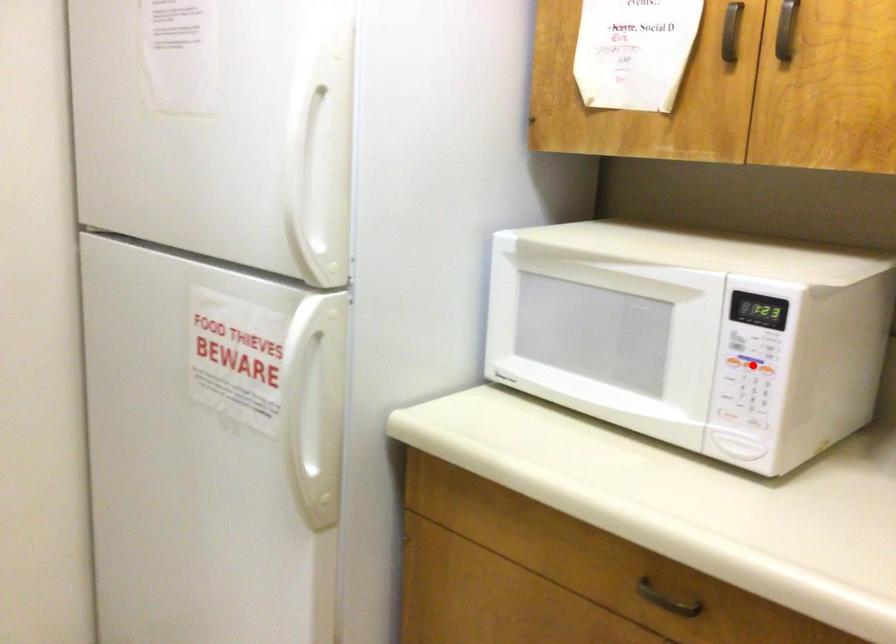
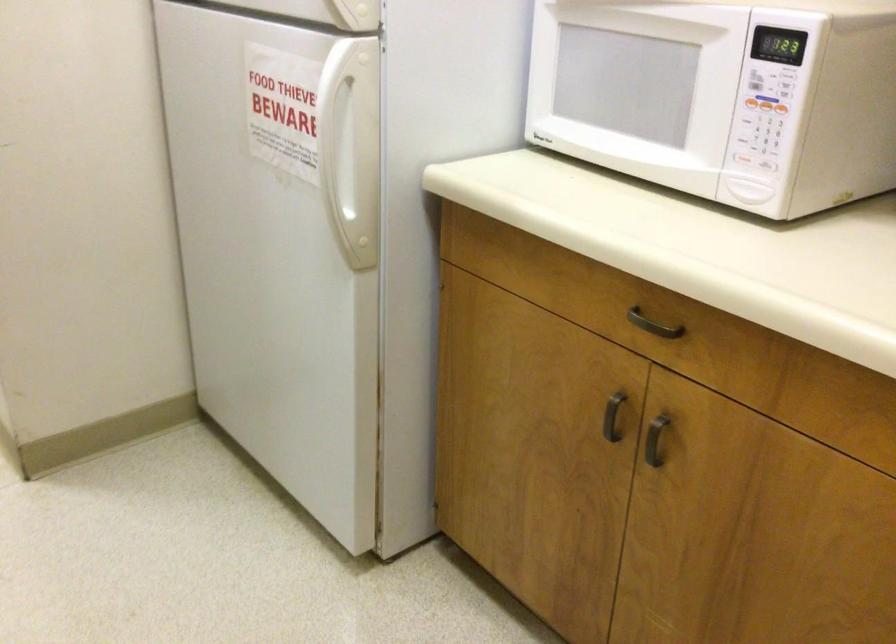
Question: I am providing you with two images of the same scene from different viewpoints. A red point is marked on the first image. Is the red point's position out of view in image 2?

Choices:
 (A) Yes
 (B) No

Answer: (B)